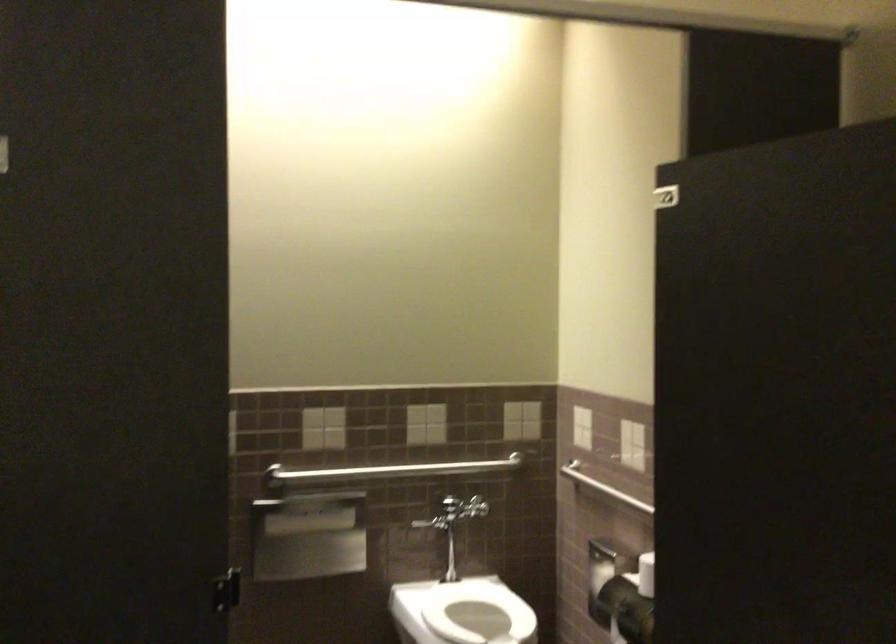
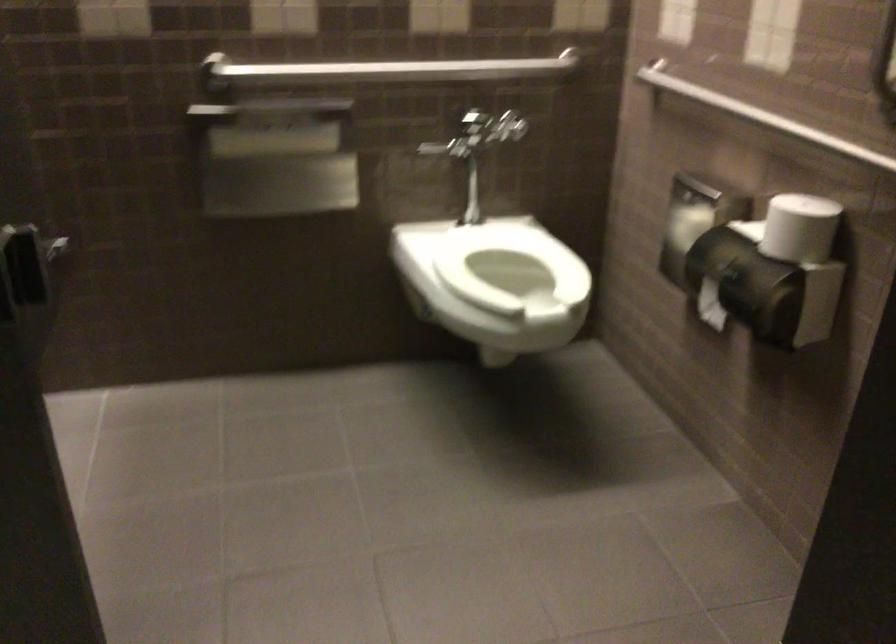
Question: I am providing you with two images of the same scene from different viewpoints. After the viewpoint changes to image2, which objects are now occluded?

Choices:
 (A) stall door handle
 (B) white toilet seat
 (C) toilet paper roll
 (D) none of these

Answer: (D)